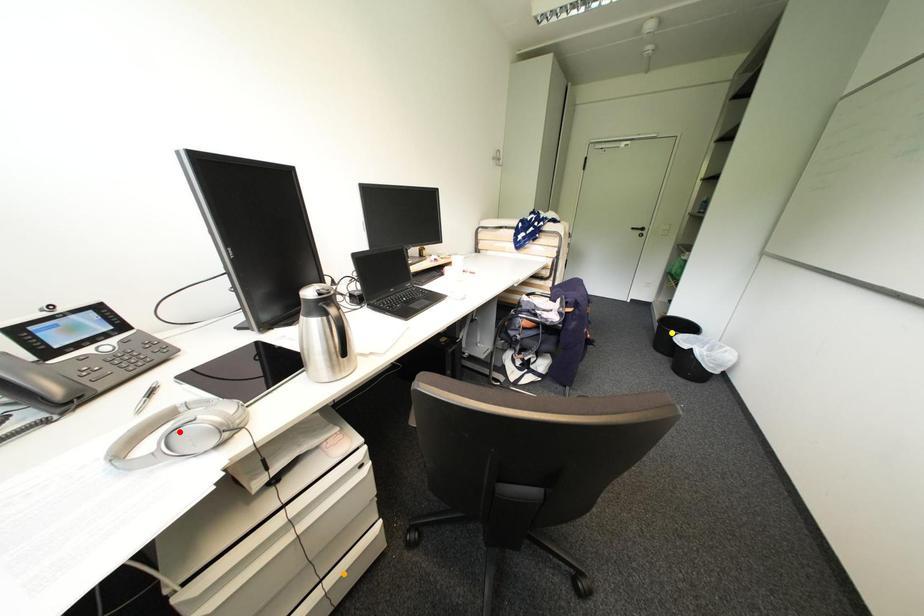
Order these from nearest to farthest:
1. yellow point
2. orange point
3. red point

1. red point
2. orange point
3. yellow point